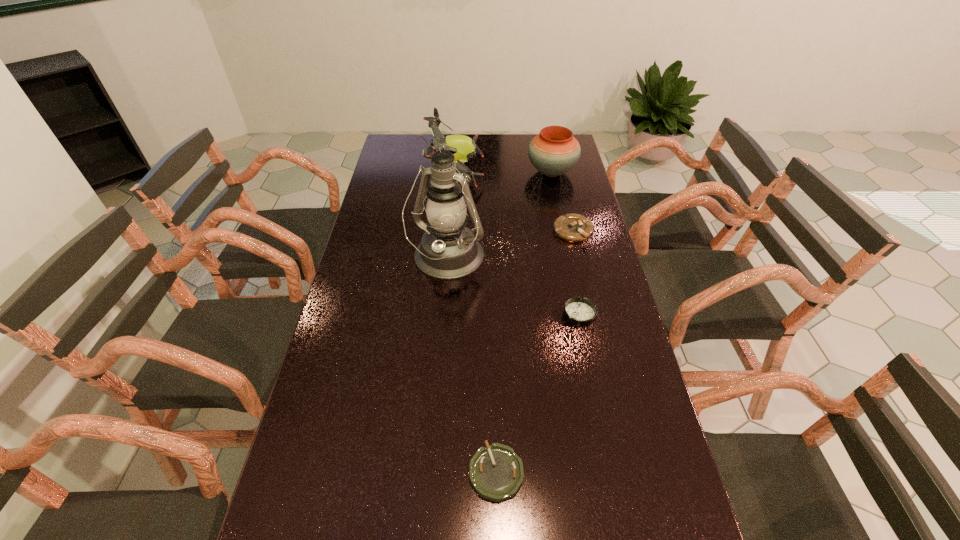
At what (x,y) coordinates should I click in order to perform the action: click on unoccupied area between the second shortest ashtray and the shortest object. Please return your answer as a coordinate pair (x, y). The width and height of the screenshot is (960, 540). Looking at the image, I should click on (538, 393).

This screenshot has width=960, height=540. Identify the location of free space between the fifth shortest object and the fourth shortest object. (503, 173).

I want to click on object that is the fifth closest to the third tallest object, so click(x=496, y=473).

The height and width of the screenshot is (540, 960). Find the location of `object that stands as the second closest to the tallest object`. object that stands as the second closest to the tallest object is located at coordinates (581, 312).

At what (x,y) coordinates should I click in order to perform the action: click on ashtray that is the closest to the shortest ashtray. Please return your answer as a coordinate pair (x, y). Looking at the image, I should click on (581, 312).

Identify which ashtray is located as the nearest to the tallest object. Please provide its 2D coordinates. Your answer should be formatted as a tuple, i.e. [(x, y)], where the tuple contains the x and y coordinates of a point satisfying the conditions above.

[(581, 312)]

Locate an element on the screen. vacant space that satisfies the following two spatial constraints: 1. on the front-facing side of the farthest ashtray; 2. on the right side of the drone is located at coordinates (450, 231).

Locate an element on the screen. This screenshot has width=960, height=540. free space that satisfies the following two spatial constraints: 1. on the front-facing side of the drone; 2. on the right side of the second nearest object is located at coordinates (444, 314).

You are a GUI agent. You are given a task and a screenshot of the screen. Output one action in this format:
    pyautogui.click(x=<x>, y=<y>)
    Task: Click on the free spot that satisfies the following two spatial constraints: 1. on the back side of the tallest ashtray; 2. on the front-facing side of the drone
    The width and height of the screenshot is (960, 540).
    Given the screenshot: What is the action you would take?
    pyautogui.click(x=560, y=174)

This screenshot has height=540, width=960. I want to click on vacant region that satisfies the following two spatial constraints: 1. on the front-facing side of the drone; 2. on the front side of the oil lamp, so pyautogui.click(x=448, y=260).